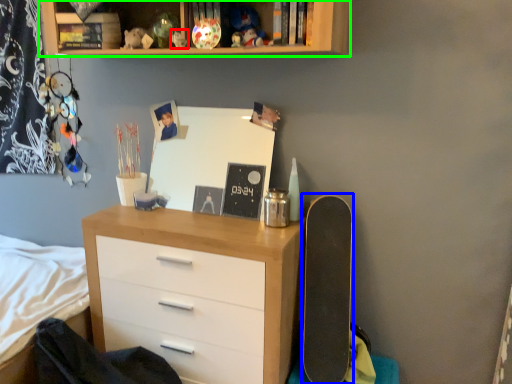
Question: Which object is positioned farthest from toy (highlighted by a red box)? Select from skateboard (highlighted by a blue box) and shelf (highlighted by a green box).

Choices:
 (A) skateboard
 (B) shelf

Answer: (A)